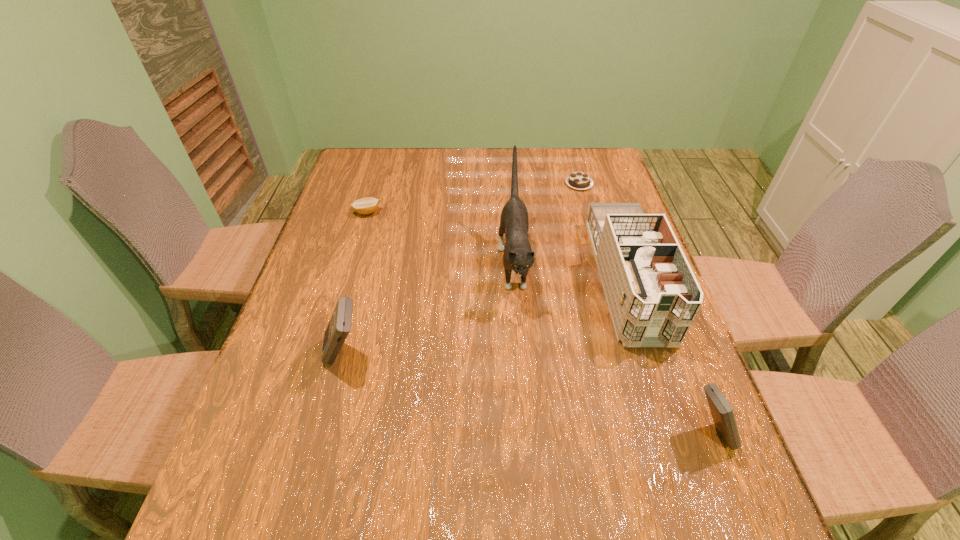
The height and width of the screenshot is (540, 960). What are the coordinates of `free spot at the near left corner of the desktop` in the screenshot? It's located at (276, 441).

Where is `free space at the far right corner of the desktop`? The height and width of the screenshot is (540, 960). free space at the far right corner of the desktop is located at coordinates (621, 184).

The image size is (960, 540). Identify the location of vacant space in between the dollhouse and the farther calculator. tap(486, 317).

The height and width of the screenshot is (540, 960). Identify the location of free spot between the tallest object and the dollhouse. (570, 271).

The width and height of the screenshot is (960, 540). I want to click on empty space between the fifth tallest object and the shorter calculator, so click(x=539, y=323).

The width and height of the screenshot is (960, 540). What are the coordinates of `free space between the chocolate cake and the third object from left to right` in the screenshot? It's located at (546, 223).

Image resolution: width=960 pixels, height=540 pixels. I want to click on free spot between the farthest object and the tallest object, so coord(546,223).

Where is `vacant area that lies between the farther calculator and the lemon`? vacant area that lies between the farther calculator and the lemon is located at coordinates (356, 284).

Identify the location of vacant region between the dollhouse and the left calculator. (486, 317).

Image resolution: width=960 pixels, height=540 pixels. In order to click on free space between the left calculator and the lemon in this screenshot , I will do `click(356, 284)`.